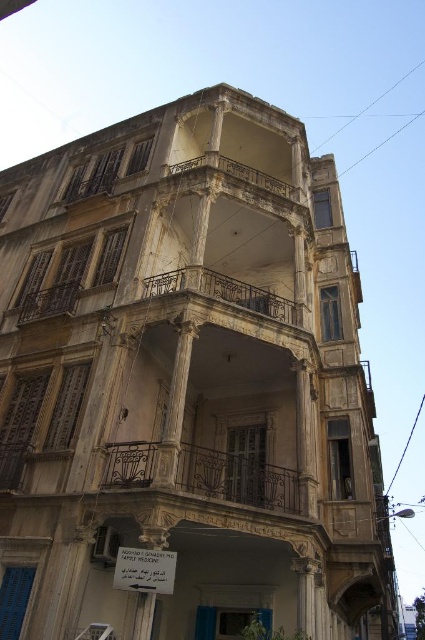
You are standing in front of the building and notice two balconies at the center. Which balcony, the rustic wrought iron balcony at center or the rusty metal balcony at center, is closer to you?

The rustic wrought iron balcony at center is closer to you because it is in front of the rusty metal balcony at center.

You are standing in front of the building and want to enter through the blue door. Which balcony, the rustic wrought iron balcony at center or the rusty metal balcony at center, is directly above the entrance area?

The rusty metal balcony at center is directly above the entrance area because the rustic wrought iron balcony at center is positioned under it.

You are a painter standing at the base of the building. You need to paint both the rustic wrought iron balcony at center and the rusty metal balcony at center. Which balcony should you paint first if you want to start with the one closer to you?

The rustic wrought iron balcony at center is closer to you than the rusty metal balcony at center, so you should paint the rustic wrought iron balcony at center first.